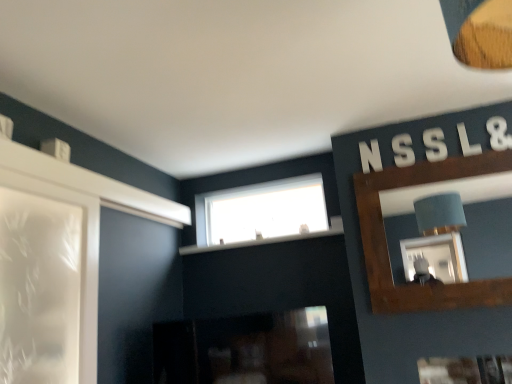
Question: Is white plastic letter s at upper right, which is counted as the 2th letter, starting from the left, wider than white plastic letter at upper right, arranged as the second letter when viewed from the right?

Choices:
 (A) yes
 (B) no

Answer: (B)

Question: Considering the relative sizes of white plastic letter s at upper right, which is counted as the 2th letter, starting from the left, and white plastic letter at upper right, arranged as the second letter when viewed from the right, in the image provided, is white plastic letter s at upper right, which is counted as the 2th letter, starting from the left, bigger than white plastic letter at upper right, arranged as the second letter when viewed from the right,?

Choices:
 (A) yes
 (B) no

Answer: (B)

Question: Does white plastic letter s at upper right, acting as the 4th letter starting from the right, turn towards white plastic letter at upper right, which is the fourth letter in left-to-right order?

Choices:
 (A) yes
 (B) no

Answer: (B)

Question: From the image's perspective, is white plastic letter s at upper right, which is counted as the 2th letter, starting from the left, below white plastic letter at upper right, arranged as the second letter when viewed from the right?

Choices:
 (A) no
 (B) yes

Answer: (B)

Question: Does white plastic letter s at upper right, which is counted as the 2th letter, starting from the left, have a greater height compared to white plastic letter at upper right, which is the fourth letter in left-to-right order?

Choices:
 (A) yes
 (B) no

Answer: (A)

Question: Is white plastic letter s at upper right, which is counted as the 2th letter, starting from the left, positioned behind white plastic letter at upper right, which is the fourth letter in left-to-right order?

Choices:
 (A) no
 (B) yes

Answer: (B)

Question: From the image's perspective, does white plastic letter at upper right, which is the fourth letter in left-to-right order, appear lower than white plastic letter at upper right, placed as the 1th letter when sorted from right to left?

Choices:
 (A) no
 (B) yes

Answer: (B)

Question: Considering the relative sizes of white plastic letter at upper right, which is the fourth letter in left-to-right order, and white plastic letter at upper right, which ranks as the fifth letter in left-to-right order, in the image provided, is white plastic letter at upper right, which is the fourth letter in left-to-right order, bigger than white plastic letter at upper right, which ranks as the fifth letter in left-to-right order,?

Choices:
 (A) no
 (B) yes

Answer: (B)

Question: Is white plastic letter at upper right, which is the fourth letter in left-to-right order, in front of white plastic letter at upper right, placed as the 1th letter when sorted from right to left?

Choices:
 (A) no
 (B) yes

Answer: (A)

Question: Are white plastic letter at upper right, arranged as the second letter when viewed from the right, and white plastic letter at upper right, which ranks as the fifth letter in left-to-right order, far apart?

Choices:
 (A) no
 (B) yes

Answer: (A)

Question: Is white plastic letter at upper right, arranged as the second letter when viewed from the right, shorter than white plastic letter at upper right, placed as the 1th letter when sorted from right to left?

Choices:
 (A) yes
 (B) no

Answer: (A)

Question: Does white plastic letter at upper right, which is the fourth letter in left-to-right order, have a smaller size compared to white plastic letter at upper right, which ranks as the fifth letter in left-to-right order?

Choices:
 (A) yes
 (B) no

Answer: (B)

Question: Is white plastic letter at upper right, placed as the 1th letter when sorted from right to left, to the left of white plastic letter n at upper right, which is the first letter in left-to-right order, from the viewer's perspective?

Choices:
 (A) yes
 (B) no

Answer: (B)